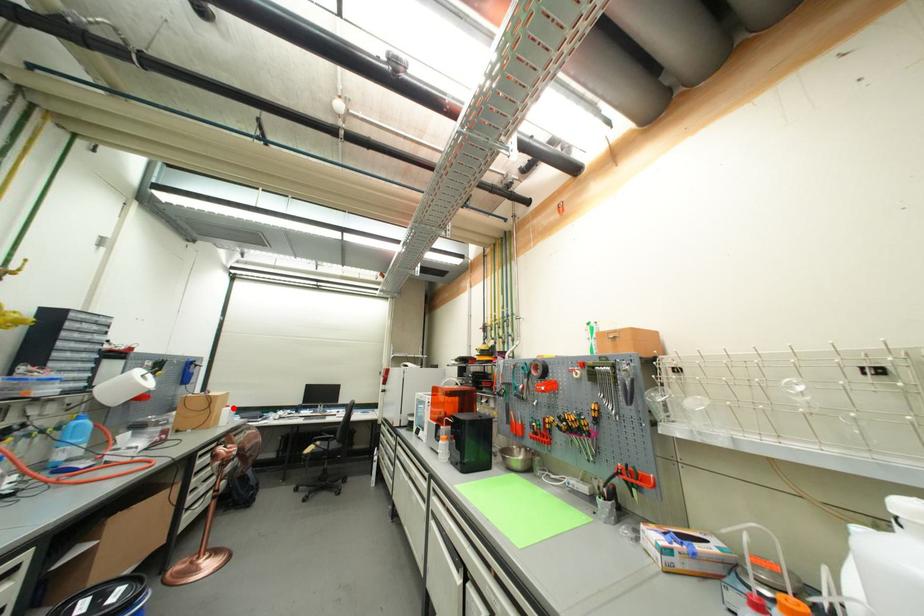
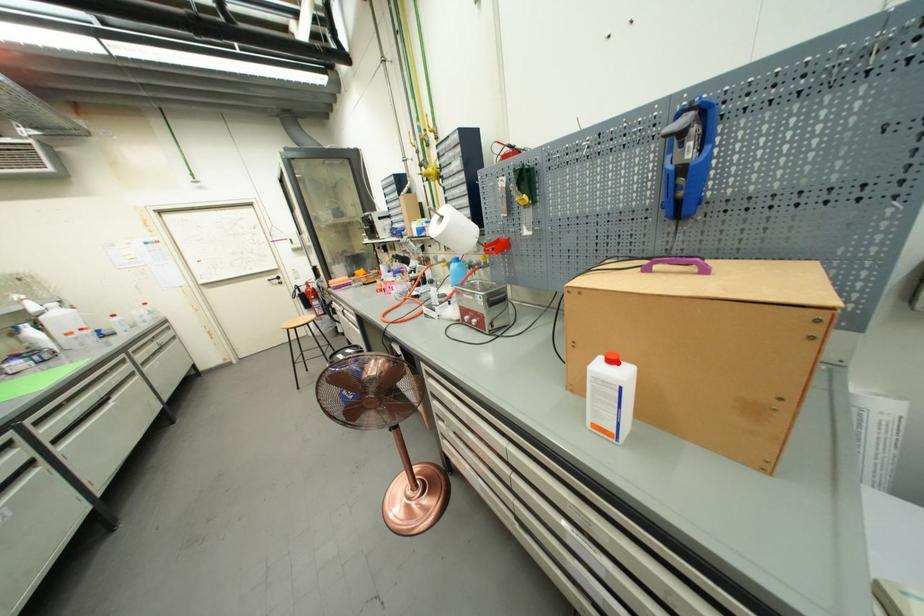
I am providing you with two images of the same scene from different viewpoints. A red point is marked on the first image and another point is marked on the second image. Is the red point in image1 aligned with the point shown in image2?

Yes